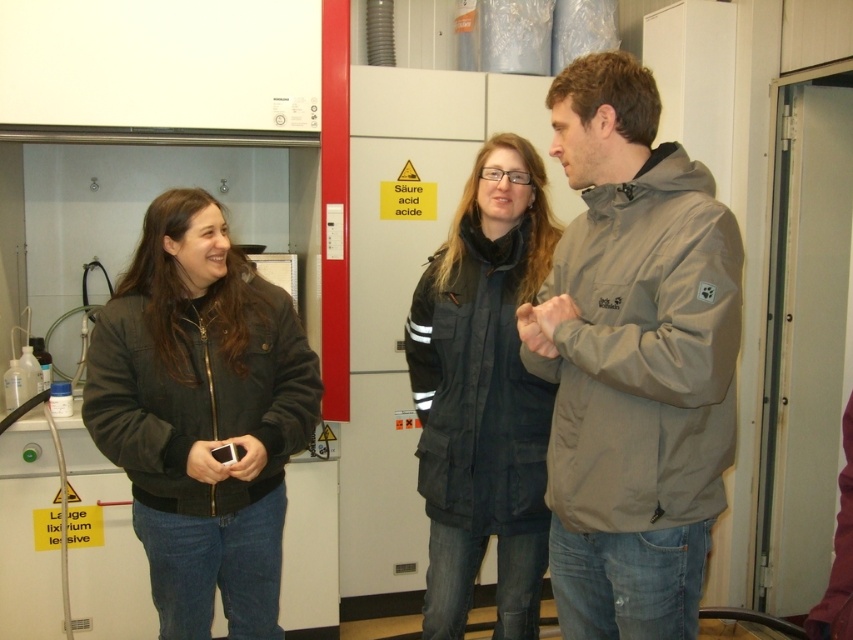
Can you confirm if gray matte jacket at center is positioned below matte black jacket at left?

Actually, gray matte jacket at center is above matte black jacket at left.

Is gray matte jacket at center closer to the viewer compared to matte black jacket at left?

Yes.

Image resolution: width=853 pixels, height=640 pixels. In order to click on gray matte jacket at center in this screenshot , I will do `click(633, 362)`.

The width and height of the screenshot is (853, 640). What are the coordinates of `matte black jacket at left` in the screenshot? It's located at (202, 416).

Where is `matte black jacket at left`? matte black jacket at left is located at coordinates (202, 416).

Which of these two, gray matte jacket at center or black puffy jacket at center, stands shorter?

With less height is gray matte jacket at center.

Looking at this image, is gray matte jacket at center shorter than black puffy jacket at center?

Correct, gray matte jacket at center is not as tall as black puffy jacket at center.

Where is `gray matte jacket at center`? This screenshot has height=640, width=853. gray matte jacket at center is located at coordinates (633, 362).